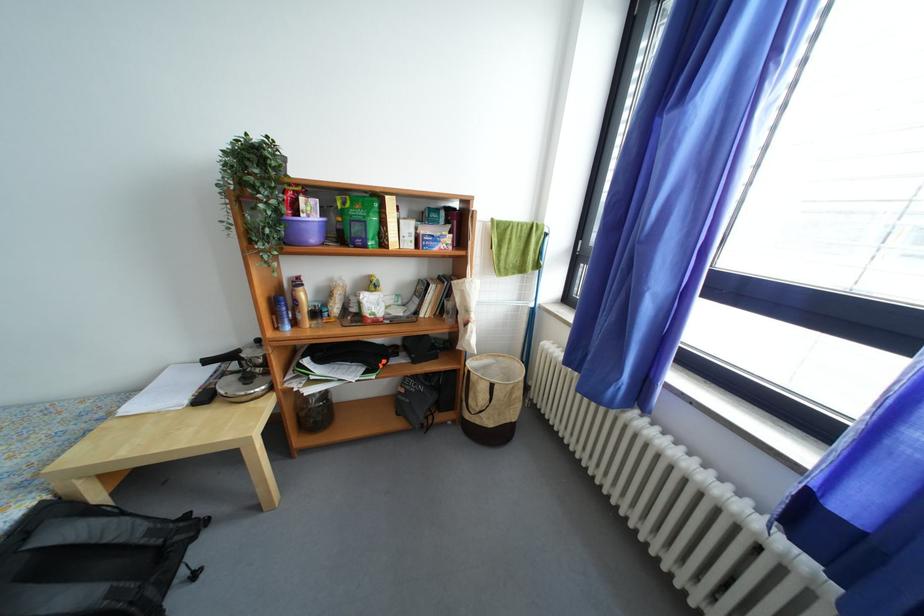
Find the location of a particular element. black pot handle is located at coordinates (224, 358).